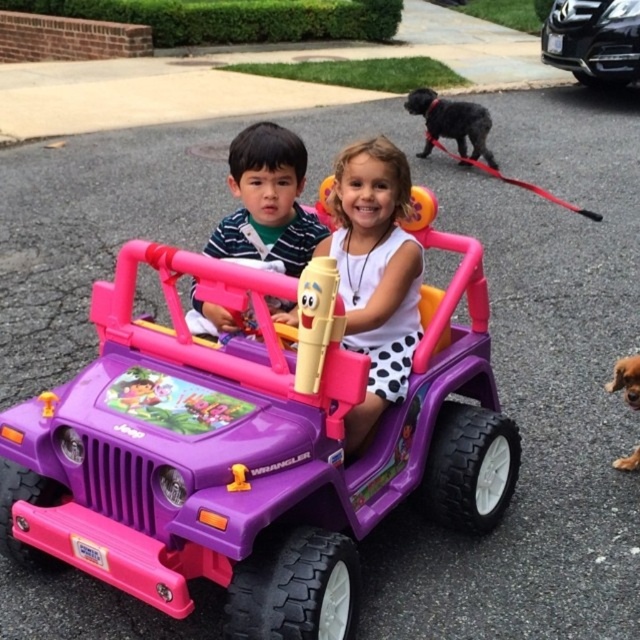
Question: Is purple plastic toy car at center positioned in front of white matte dress at center?

Choices:
 (A) no
 (B) yes

Answer: (B)

Question: Can you confirm if purple plastic toy car at center is positioned to the right of brown furry dog at lower right?

Choices:
 (A) no
 (B) yes

Answer: (A)

Question: Is white matte dress at center wider than brown furry dog at lower right?

Choices:
 (A) no
 (B) yes

Answer: (B)

Question: Which point is farther from the camera taking this photo?

Choices:
 (A) (10, 524)
 (B) (593, 74)
 (C) (380, 305)
 (D) (621, 458)

Answer: (B)

Question: Based on their relative distances, which object is nearer to the matte striped shirt at center?

Choices:
 (A) black fuzzy dog at upper right
 (B) white matte dress at center

Answer: (B)

Question: Which point appears farthest from the camera in this image?

Choices:
 (A) (374, 196)
 (B) (413, 106)

Answer: (B)